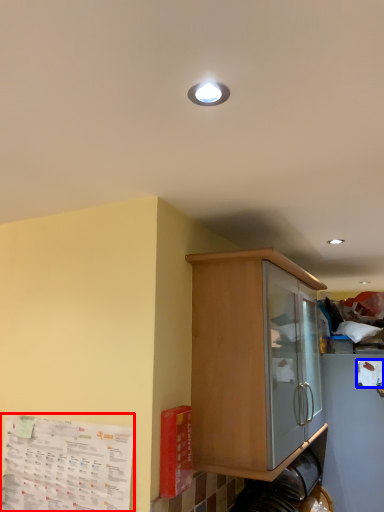
Question: Which of the following is the closest to the observer, paper (highlighted by a red box) or paper (highlighted by a blue box)?

Choices:
 (A) paper
 (B) paper

Answer: (A)